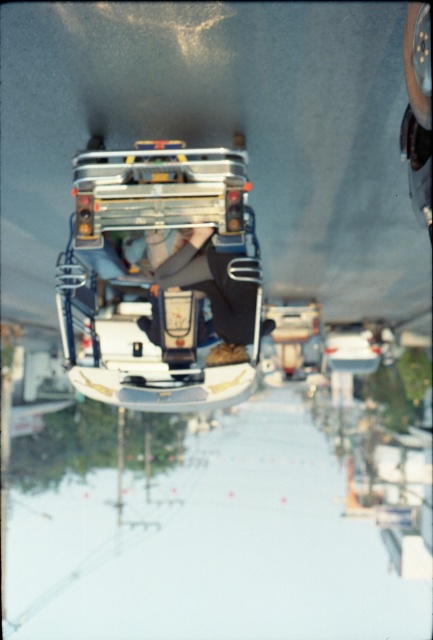
You are a photographer trying to capture the best shot of the two points marked in the image. Which point, point 1 at coordinates point (167, 182) or point 2 at coordinates point (191, 241), would appear larger in your photo due to its position relative to the camera?

Point 1 at coordinates point (167, 182) would appear larger in the photo because it is closer to the camera than point 2 at coordinates point (191, 241).

You are observing a ski lift scene from a distance. You notice the metallic silver ski lift at center and the leather black pants at center. Which object is taller in the image?

The metallic silver ski lift at center is taller than the leather black pants at center according to the description.

You are a photographer trying to capture a clear photo of both the metallic silver ski lift at center and the leather black pants at center in the scene. Based on their sizes, which object should you focus on first to ensure it appears sharp in the photo?

The metallic silver ski lift at center is larger in size than the leather black pants at center, so you should focus on the metallic silver ski lift at center first to ensure it appears sharp in the photo.